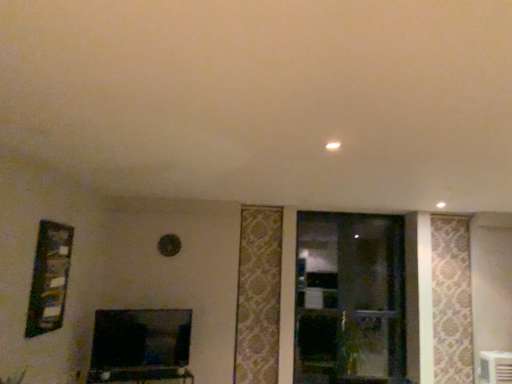
Question: Is white plastic air conditioner at lower right taller than green leafy plant at center?

Choices:
 (A) no
 (B) yes

Answer: (A)

Question: Can you confirm if white plastic air conditioner at lower right is thinner than green leafy plant at center?

Choices:
 (A) yes
 (B) no

Answer: (A)

Question: Does white plastic air conditioner at lower right appear on the right side of green leafy plant at center?

Choices:
 (A) yes
 (B) no

Answer: (A)

Question: Considering the relative sizes of white plastic air conditioner at lower right and green leafy plant at center in the image provided, is white plastic air conditioner at lower right wider than green leafy plant at center?

Choices:
 (A) yes
 (B) no

Answer: (B)

Question: From the image's perspective, does white plastic air conditioner at lower right appear lower than green leafy plant at center?

Choices:
 (A) yes
 (B) no

Answer: (B)

Question: Would you say white plastic air conditioner at lower right contains green leafy plant at center?

Choices:
 (A) yes
 (B) no

Answer: (B)

Question: Is matte black tv stand at lower center taller than wooden frame at left?

Choices:
 (A) no
 (B) yes

Answer: (A)

Question: Can you confirm if matte black tv stand at lower center is positioned to the right of wooden frame at left?

Choices:
 (A) yes
 (B) no

Answer: (A)

Question: Is matte black tv stand at lower center oriented away from wooden frame at left?

Choices:
 (A) yes
 (B) no

Answer: (B)

Question: Is matte black tv stand at lower center oriented towards wooden frame at left?

Choices:
 (A) yes
 (B) no

Answer: (B)

Question: Is matte black tv stand at lower center not within wooden frame at left?

Choices:
 (A) yes
 (B) no

Answer: (A)

Question: From the image's perspective, is matte black tv stand at lower center below wooden frame at left?

Choices:
 (A) yes
 (B) no

Answer: (A)

Question: Is green leafy plant at center far away from white plastic air conditioner at lower right?

Choices:
 (A) no
 (B) yes

Answer: (B)